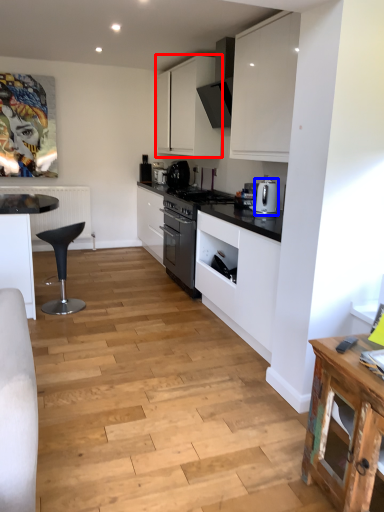
Question: Which object appears closest to the camera in this image, cabinetry (highlighted by a red box) or kitchen appliance (highlighted by a blue box)?

Choices:
 (A) cabinetry
 (B) kitchen appliance

Answer: (B)